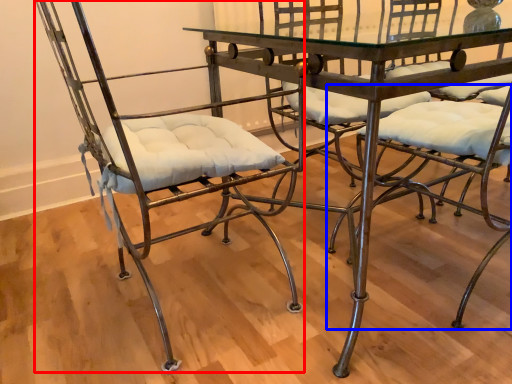
Question: Which object appears closest to the camera in this image, chair (highlighted by a red box) or chair (highlighted by a blue box)?

Choices:
 (A) chair
 (B) chair

Answer: (A)